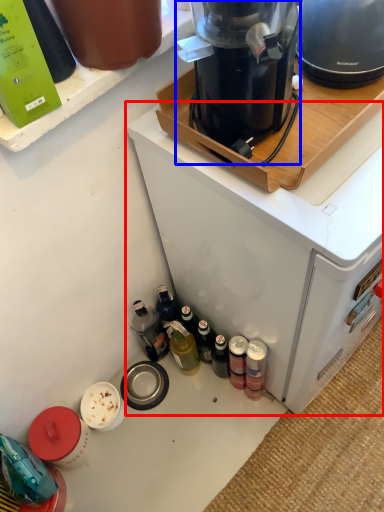
Question: Which point is closer to the camera, home appliance (highlighted by a red box) or kitchen appliance (highlighted by a blue box)?

Choices:
 (A) home appliance
 (B) kitchen appliance

Answer: (B)